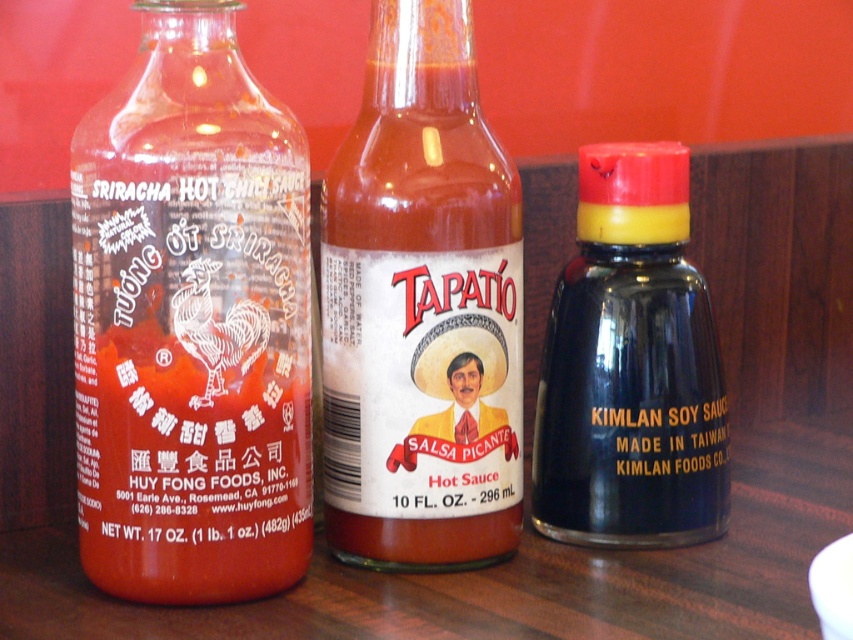
You are standing at the point marked as point [160,589] and want to pick up the bottle on the right. Can you reach it without moving your feet?

The distance between point [160,589] and the viewer is 26.51 inches. Since the bottle on the right is within this distance, you can reach it without moving your feet.

You are a delivery person who needs to place a new hot sauce bottle between the translucent glass sriracha hot chili sauce bottle at left and the matte glass bottle at center. The new bottle is 3 inches wide. Can you fit it in the space between them without moving the existing bottles?

The space between the translucent glass sriracha hot chili sauce bottle at left and the matte glass bottle at center is 4.23 inches. Since the new bottle is 3 inches wide, it can fit in the space between them without moving the existing bottles.